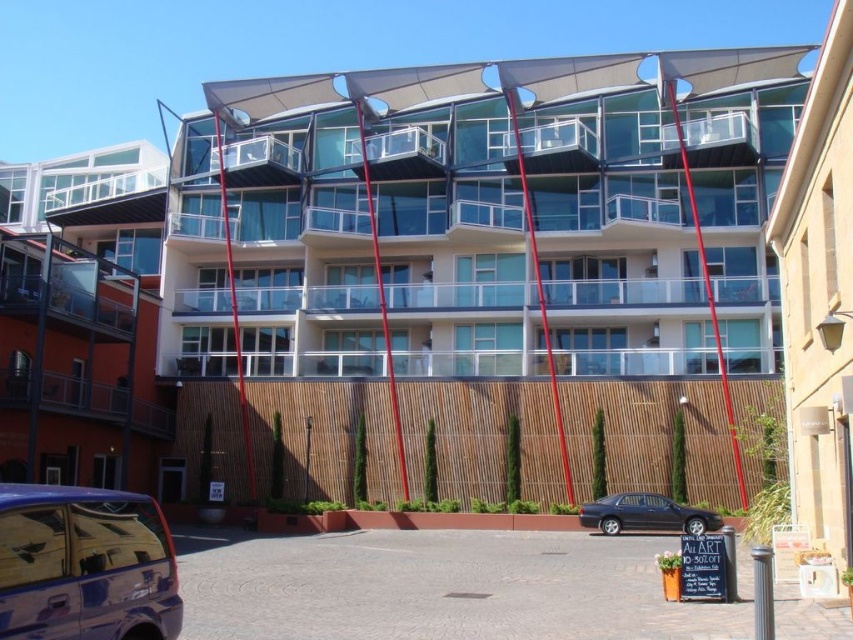
Question: Among these points, which one is farthest from the camera?

Choices:
 (A) (164, 547)
 (B) (851, 392)

Answer: (B)

Question: Which is nearer to the glossy black sedan at lower center?

Choices:
 (A) brown wooden building at upper center
 (B) shiny metallic van at lower left
 (C) matte glass building at center

Answer: (A)

Question: Which of the following is the closest to the observer?

Choices:
 (A) shiny metallic van at lower left
 (B) matte glass building at center

Answer: (A)

Question: Does brown wooden building at upper center have a larger size compared to shiny metallic van at lower left?

Choices:
 (A) yes
 (B) no

Answer: (A)

Question: Can you confirm if brown wooden building at upper center is positioned below glossy black sedan at lower center?

Choices:
 (A) yes
 (B) no

Answer: (B)

Question: Does brown wooden building at upper center appear under glossy black sedan at lower center?

Choices:
 (A) no
 (B) yes

Answer: (A)